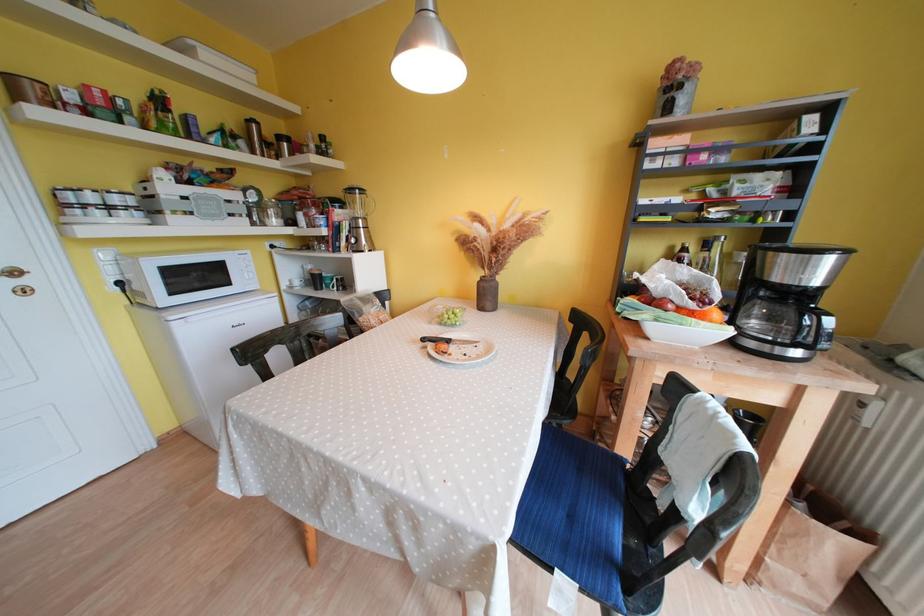
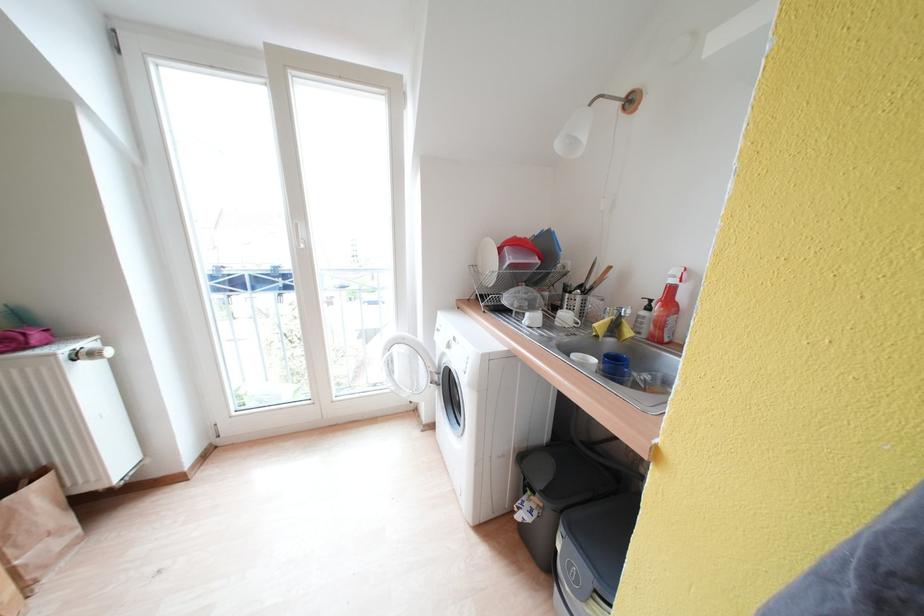
Where in the second image is the point corresponding to (852,528) from the first image?

(30, 485)